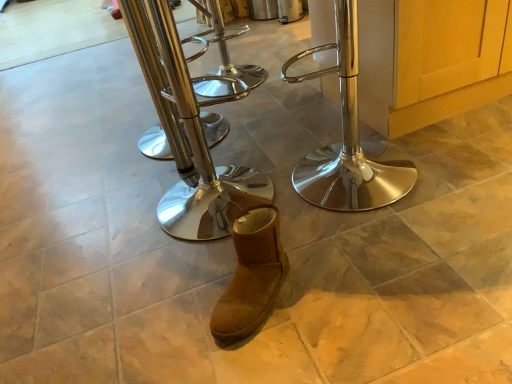
Locate an element on the screen. The height and width of the screenshot is (384, 512). free space on the front side of polished chrome stool at center, which ranks as the 3th step stool in left-to-right order is located at coordinates (393, 248).